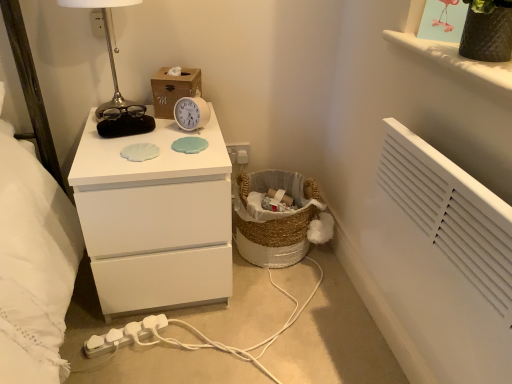
At what (x,y) coordinates should I click in order to perform the action: click on vacant area located to the right-hand side of white matte chest of drawers at center. Please return your answer as a coordinate pair (x, y). Looking at the image, I should click on (288, 310).